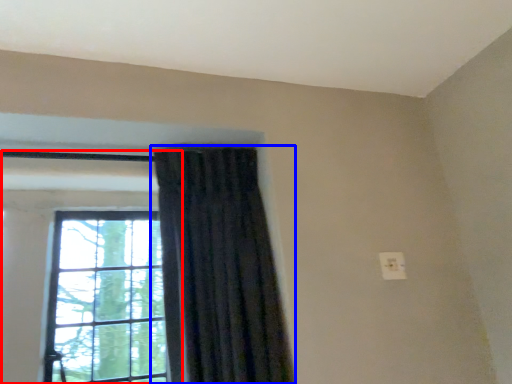
Question: Which point is further to the camera, window (highlighted by a red box) or curtain (highlighted by a blue box)?

Choices:
 (A) window
 (B) curtain

Answer: (A)